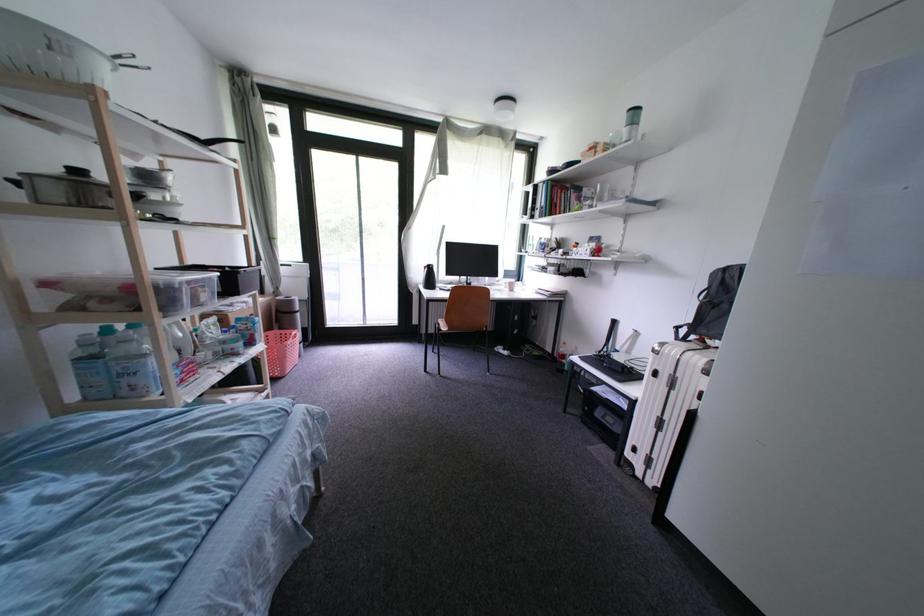
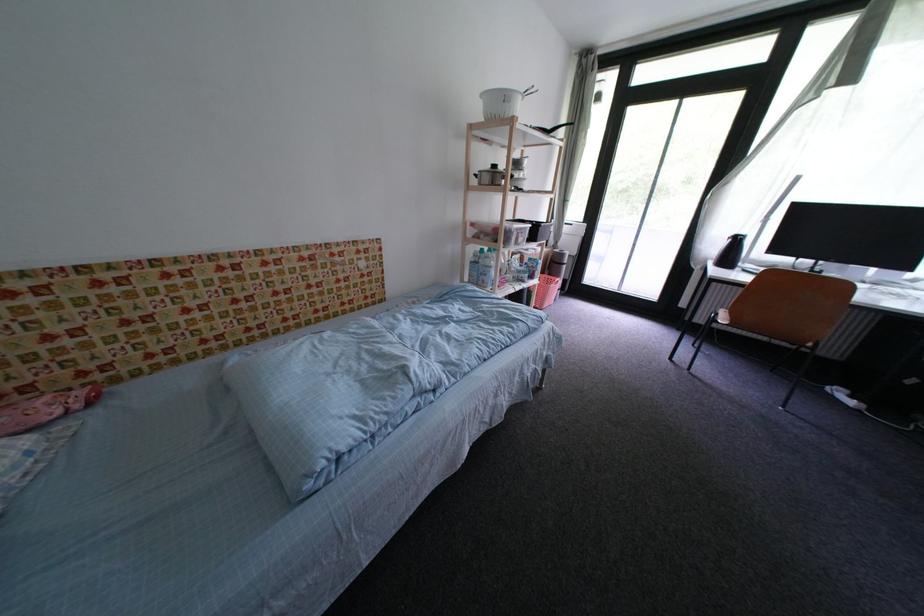
Where in the second image is the point corresponding to the point at 80,400 from the first image?

(475, 281)